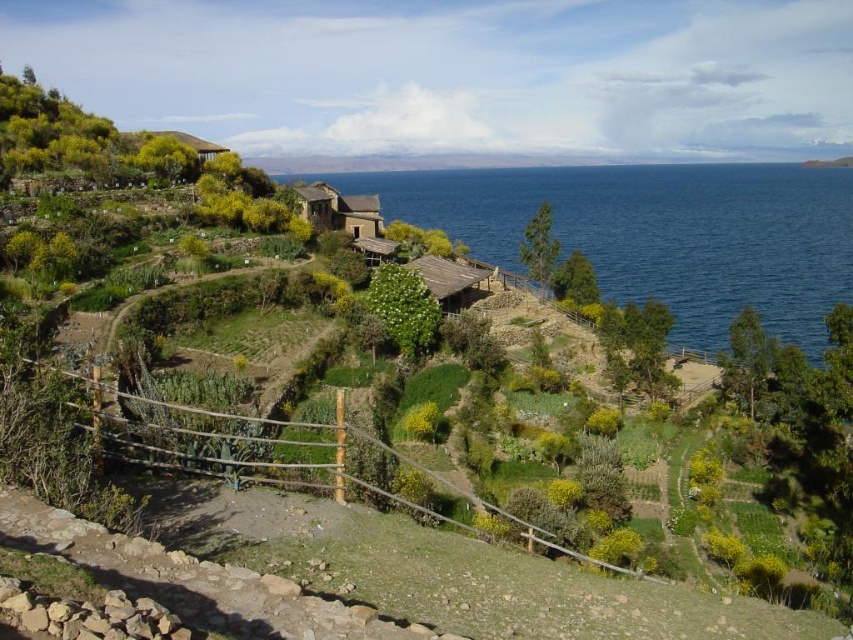
Consider the image. Which of these two, wooden hut at center or wooden hut at upper left, stands shorter?

With less height is wooden hut at center.

Is point (445, 259) behind point (206, 156)?

That is True.

I want to click on wooden hut at center, so click(450, 280).

Who is higher up, rustic stone hut at center or wooden hut at center?

rustic stone hut at center is higher up.

Which is below, rustic stone hut at center or wooden hut at center?

wooden hut at center

Find the location of a particular element. This screenshot has height=640, width=853. rustic stone hut at center is located at coordinates (338, 211).

Where is `rustic stone hut at center`? The width and height of the screenshot is (853, 640). rustic stone hut at center is located at coordinates (338, 211).

What do you see at coordinates (338, 211) in the screenshot?
I see `rustic stone hut at center` at bounding box center [338, 211].

Between rustic stone hut at center and wooden hut at upper left, which one appears on the right side from the viewer's perspective?

rustic stone hut at center is more to the right.

Between point (358, 225) and point (215, 147), which one is positioned behind?

Positioned behind is point (358, 225).

Find the location of a particular element. The image size is (853, 640). rustic stone hut at center is located at coordinates (338, 211).